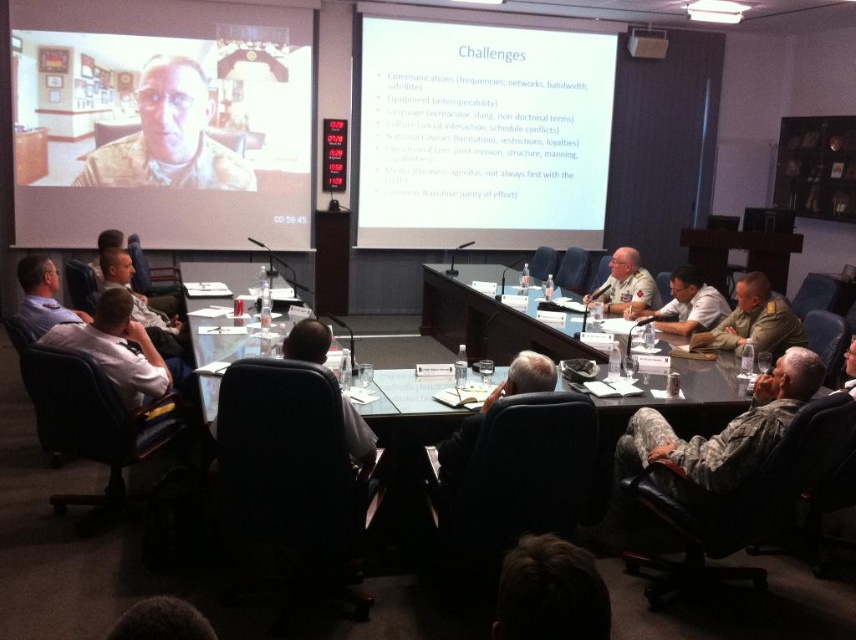
You are a photographer standing at the back of the room. You want to take a photo that includes both the white paper at upper center and the camouflage uniform at right without moving your position. Can you fit both in the frame if your camera has a 5 meter field of view?

The distance between the white paper at upper center and the camouflage uniform at right is 4.15 meters. Since your camera has a 5 meter field of view, which is wider than the 4.15 meters separating them, you can fit both in the frame without moving.

You are a photographer positioned at the back of the room. You need to take a photo of the two individuals in matte black uniforms. Which one, the matte black uniform at upper left or the matte black uniform at left, will be closer to the camera in your photo?

The matte black uniform at upper left will be closer to the camera because the matte black uniform at left is behind it, making the upper left one more visible in the photo.

Looking at this image, you are a photographer setting up for a group photo in the conference room. You need to position your camera so that both the point at coordinates point (x=21, y=221) and point (x=607, y=305) are in focus. Which point should you focus on first to ensure both are sharp?

You should focus on point (x=21, y=221) first because it is closer to the camera than point (x=607, y=305). By focusing on the closer point, the farther point will also be within the depth of field, ensuring both are sharp.